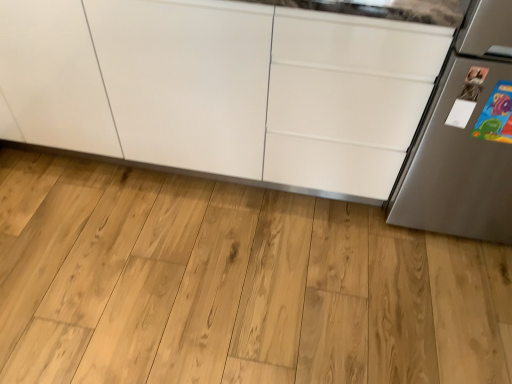
Question: Is natural wood flooring at center taller or shorter than white glossy cabinet at center?

Choices:
 (A) short
 (B) tall

Answer: (A)

Question: Considering the positions of natural wood flooring at center and white glossy cabinet at center in the image, is natural wood flooring at center bigger or smaller than white glossy cabinet at center?

Choices:
 (A) big
 (B) small

Answer: (B)

Question: Estimate the real-world distances between objects in this image. Which object is farther from the satin silver refrigerator at right?

Choices:
 (A) white glossy cabinet at center
 (B) natural wood flooring at center

Answer: (B)

Question: Estimate the real-world distances between objects in this image. Which object is closer to the white glossy cabinet at center?

Choices:
 (A) natural wood flooring at center
 (B) satin silver refrigerator at right

Answer: (A)